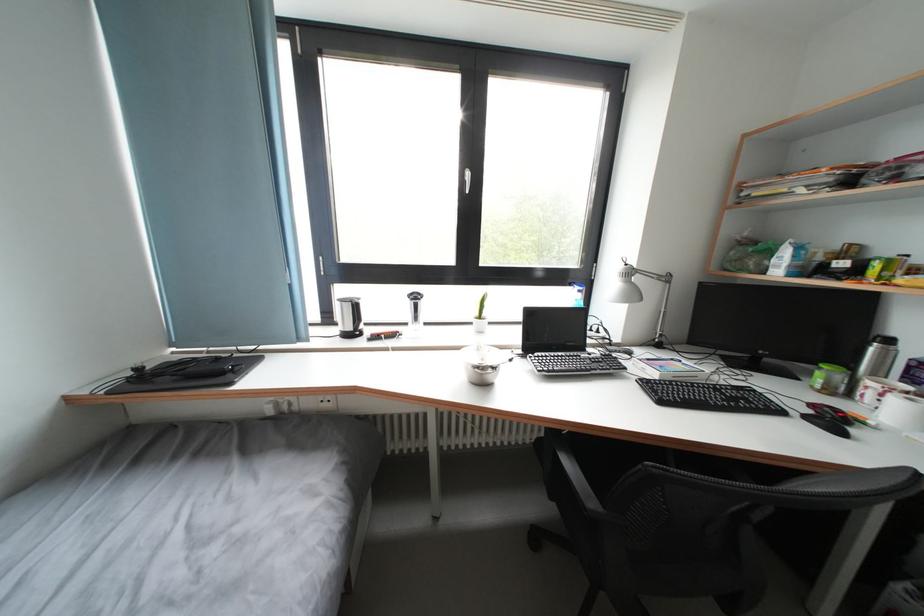
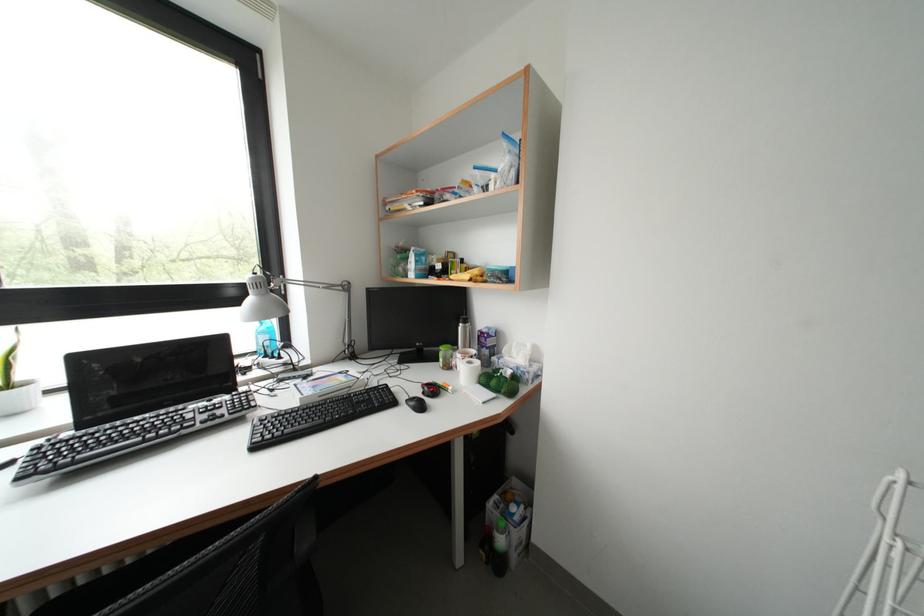
Find the pixel in the second image that matches [775,257] in the first image.

(415, 264)